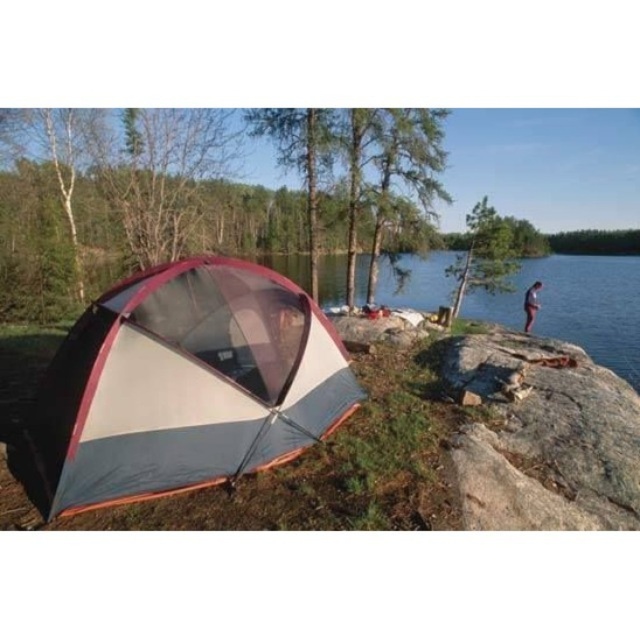
Question: Which object appears closest to the camera in this image?

Choices:
 (A) multicolored fabric tent at left
 (B) gray rough rock at right
 (C) light blue jeans at right

Answer: (A)

Question: Which point is closer to the camera taking this photo?

Choices:
 (A) [515, 376]
 (B) [531, 296]
 (C) [333, 364]

Answer: (C)

Question: Does multicolored fabric tent at left have a greater width compared to light blue jeans at right?

Choices:
 (A) yes
 (B) no

Answer: (A)

Question: Can you confirm if gray rough rock at right is positioned below light blue jeans at right?

Choices:
 (A) yes
 (B) no

Answer: (A)

Question: Can you confirm if multicolored fabric tent at left is wider than gray rough rock at right?

Choices:
 (A) yes
 (B) no

Answer: (A)

Question: Which point is closer to the camera?

Choices:
 (A) light blue jeans at right
 (B) gray rough rock at right

Answer: (B)